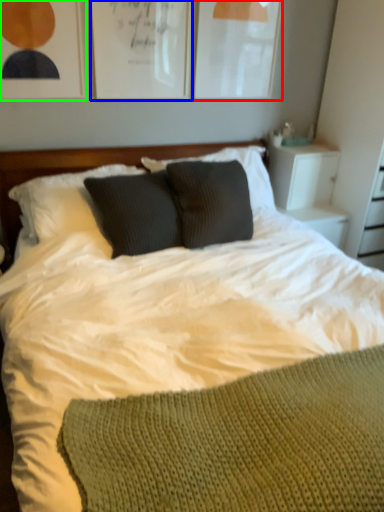
Question: Which object is positioned closest to picture frame (highlighted by a red box)? Select from picture frame (highlighted by a blue box) and picture frame (highlighted by a green box).

Choices:
 (A) picture frame
 (B) picture frame

Answer: (A)